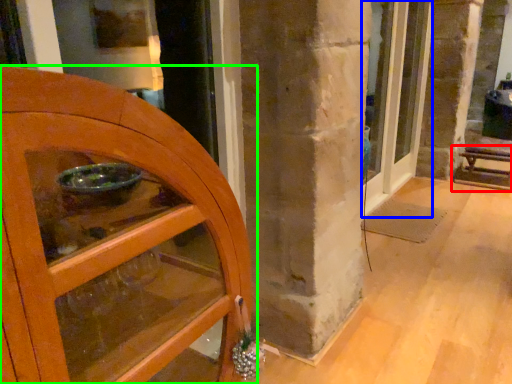
Question: Which object is positioned closest to furniture (highlighted by a red box)? Select from door (highlighted by a blue box) and door (highlighted by a green box).

Choices:
 (A) door
 (B) door

Answer: (A)